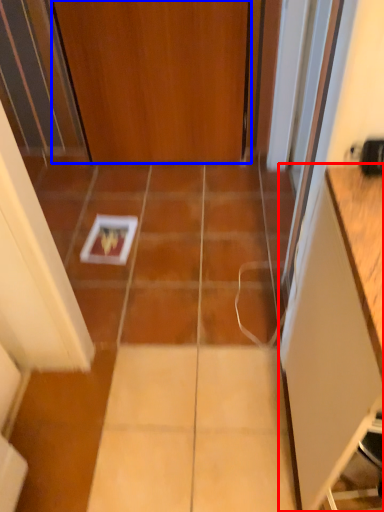
Question: Which point is closer to the camera, cabinetry (highlighted by a red box) or door (highlighted by a blue box)?

Choices:
 (A) cabinetry
 (B) door

Answer: (A)